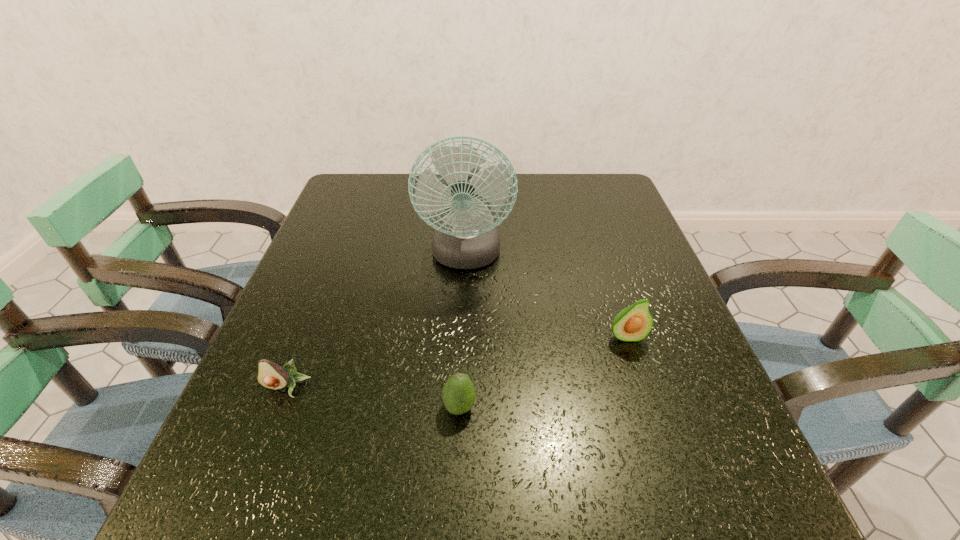
You are a GUI agent. You are given a task and a screenshot of the screen. Output one action in this format:
    pyautogui.click(x=<x>, y=<y>)
    Task: Click on the object that is the nearest to the leftmost avocado
    The width and height of the screenshot is (960, 540).
    Given the screenshot: What is the action you would take?
    pyautogui.click(x=458, y=394)

Locate which avocado ranks second in proximity to the second farthest object. Please provide its 2D coordinates. Your answer should be formatted as a tuple, i.e. [(x, y)], where the tuple contains the x and y coordinates of a point satisfying the conditions above.

[(270, 375)]

Select which avocado appears as the second closest to the fan. Please provide its 2D coordinates. Your answer should be formatted as a tuple, i.e. [(x, y)], where the tuple contains the x and y coordinates of a point satisfying the conditions above.

[(458, 394)]

You are a GUI agent. You are given a task and a screenshot of the screen. Output one action in this format:
    pyautogui.click(x=<x>, y=<y>)
    Task: Click on the free spot that satisfies the following two spatial constraints: 1. on the seed side of the leftmost avocado; 2. on the left side of the second avocado from left to right
    
    Given the screenshot: What is the action you would take?
    pyautogui.click(x=279, y=407)

Where is `free space that satisfies the following two spatial constraints: 1. on the seed side of the leftmost object; 2. on the right side of the second avocado from right to left`? The width and height of the screenshot is (960, 540). free space that satisfies the following two spatial constraints: 1. on the seed side of the leftmost object; 2. on the right side of the second avocado from right to left is located at coordinates (279, 407).

Identify the location of free space that satisfies the following two spatial constraints: 1. on the seed side of the leftmost object; 2. on the left side of the second avocado from right to left. (279, 407).

Find the location of a particular element. vacant region that satisfies the following two spatial constraints: 1. on the seed side of the second avocado from left to right; 2. on the left side of the leftmost object is located at coordinates (279, 407).